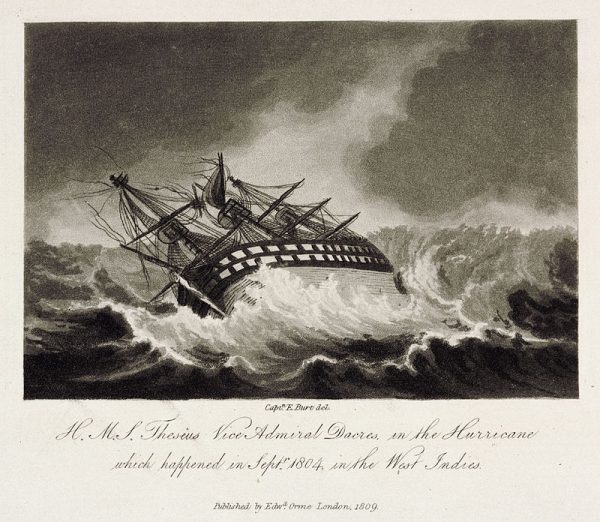
This screenshot has height=522, width=600. What are the coordinates of `upper right corner of artwork` in the screenshot? It's located at (574, 16).